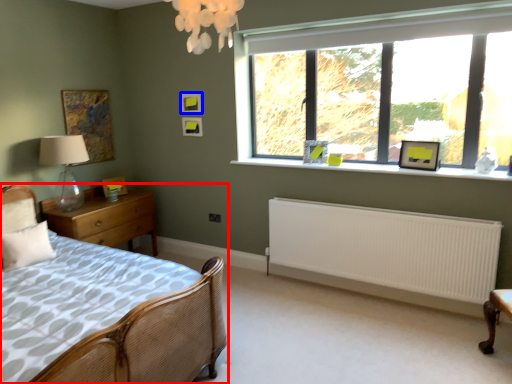
Question: Which of the following is the closest to the observer, bed (highlighted by a red box) or picture frame (highlighted by a blue box)?

Choices:
 (A) bed
 (B) picture frame

Answer: (A)